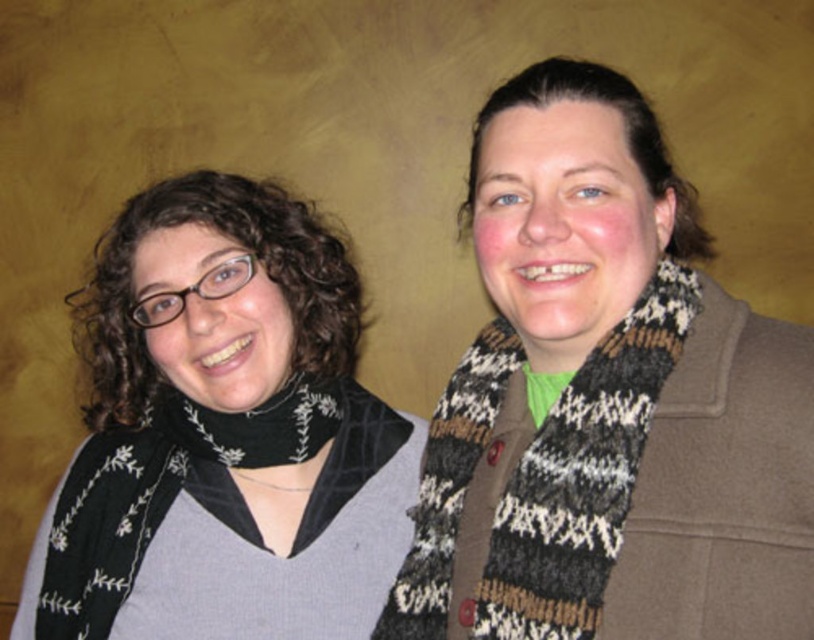
Is black knitted scarf at left in front of knitted wool scarf at right?

No, it is behind knitted wool scarf at right.

Who is lower down, black knitted scarf at left or knitted wool scarf at right?

Positioned lower is black knitted scarf at left.

This screenshot has width=814, height=640. Find the location of `black knitted scarf at left`. black knitted scarf at left is located at coordinates (230, 429).

Can you confirm if knitted scarf at center is bigger than black knitted scarf at left?

No.

Is knitted scarf at center shorter than black knitted scarf at left?

Indeed, knitted scarf at center has a lesser height compared to black knitted scarf at left.

Is point (495, 538) more distant than point (186, 499)?

That is False.

You are a GUI agent. You are given a task and a screenshot of the screen. Output one action in this format:
    pyautogui.click(x=<x>, y=<y>)
    Task: Click on the knitted scarf at center
    Image resolution: width=814 pixels, height=640 pixels.
    Given the screenshot: What is the action you would take?
    pyautogui.click(x=606, y=403)

Between knitted scarf at center and knitted wool scarf at right, which one has less height?

knitted wool scarf at right

This screenshot has height=640, width=814. What do you see at coordinates (606, 403) in the screenshot? I see `knitted scarf at center` at bounding box center [606, 403].

You are a GUI agent. You are given a task and a screenshot of the screen. Output one action in this format:
    pyautogui.click(x=<x>, y=<y>)
    Task: Click on the knitted scarf at center
    This screenshot has height=640, width=814.
    Given the screenshot: What is the action you would take?
    pyautogui.click(x=606, y=403)